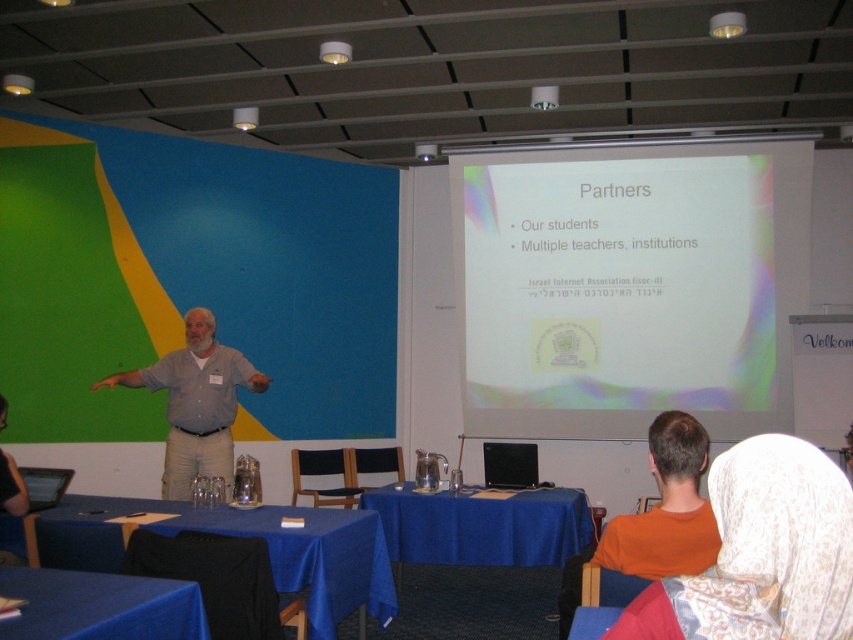
Question: Is white matte projector screen at upper center further to camera compared to white lace headscarf at upper right?

Choices:
 (A) no
 (B) yes

Answer: (B)

Question: Which point is closer to the camera taking this photo?

Choices:
 (A) (772, 538)
 (B) (654, 480)
 (C) (196, 356)

Answer: (A)

Question: Is blue fabric table at lower center to the right of gray cotton shirt at center from the viewer's perspective?

Choices:
 (A) no
 (B) yes

Answer: (B)

Question: Is gray cotton shirt at center smaller than blue fabric table at lower left?

Choices:
 (A) yes
 (B) no

Answer: (B)

Question: Which point is closer to the camera?

Choices:
 (A) (693, 506)
 (B) (171, 387)

Answer: (A)

Question: Which of the following is the farthest from the observer?

Choices:
 (A) (711, 518)
 (B) (175, 593)
 (C) (766, 282)

Answer: (C)